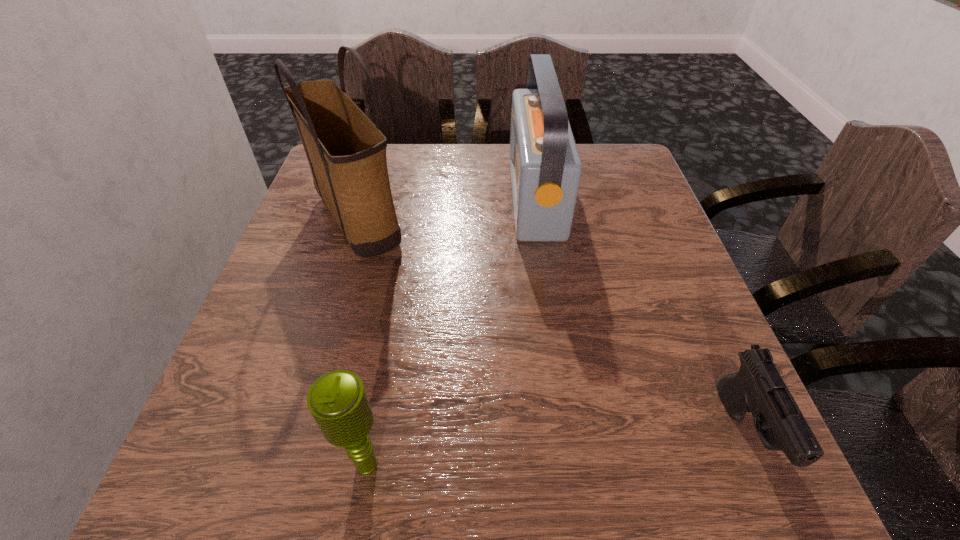
You are a GUI agent. You are given a task and a screenshot of the screen. Output one action in this format:
    pyautogui.click(x=<x>, y=<y>)
    Task: Click on the free region located on the left of the microphone
    The height and width of the screenshot is (540, 960).
    Given the screenshot: What is the action you would take?
    pyautogui.click(x=201, y=464)

Locate an element on the screen. tote bag that is positioned at the far edge is located at coordinates (346, 152).

You are a GUI agent. You are given a task and a screenshot of the screen. Output one action in this format:
    pyautogui.click(x=<x>, y=<y>)
    Task: Click on the radio receiver located in the far edge section of the desktop
    This screenshot has width=960, height=540.
    Given the screenshot: What is the action you would take?
    pyautogui.click(x=545, y=166)

Locate an element on the screen. microphone at the near edge is located at coordinates (337, 400).

Where is `pistol located at the near edge`? This screenshot has height=540, width=960. pistol located at the near edge is located at coordinates (758, 387).

The height and width of the screenshot is (540, 960). I want to click on object that is at the left edge, so click(346, 152).

This screenshot has height=540, width=960. What are the coordinates of `object present at the right edge` in the screenshot? It's located at (758, 387).

Locate an element on the screen. Image resolution: width=960 pixels, height=540 pixels. object present at the far left corner is located at coordinates point(346,152).

Locate an element on the screen. This screenshot has height=540, width=960. object present at the near right corner is located at coordinates (758, 387).

What are the coordinates of `vacant space at the far edge of the desktop` in the screenshot? It's located at (433, 185).